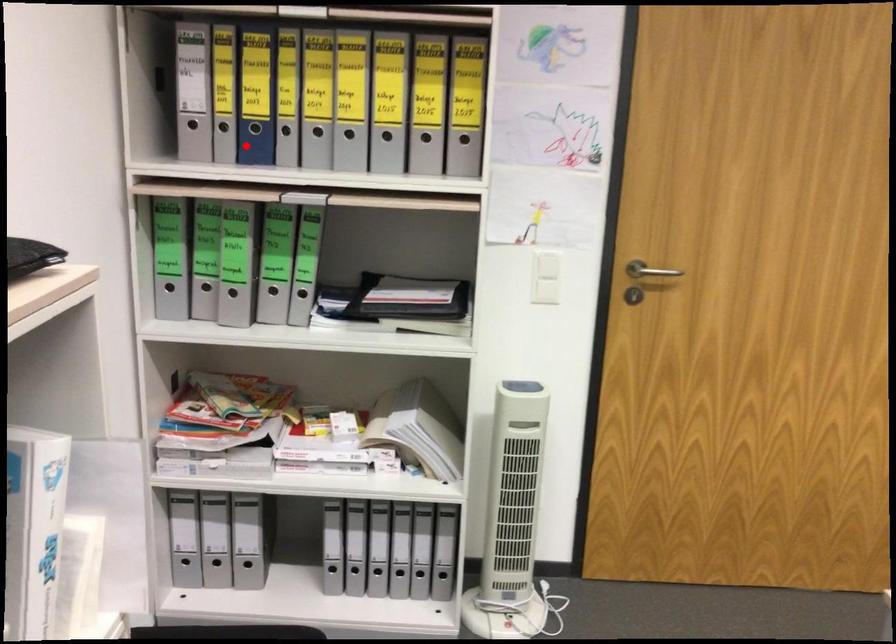
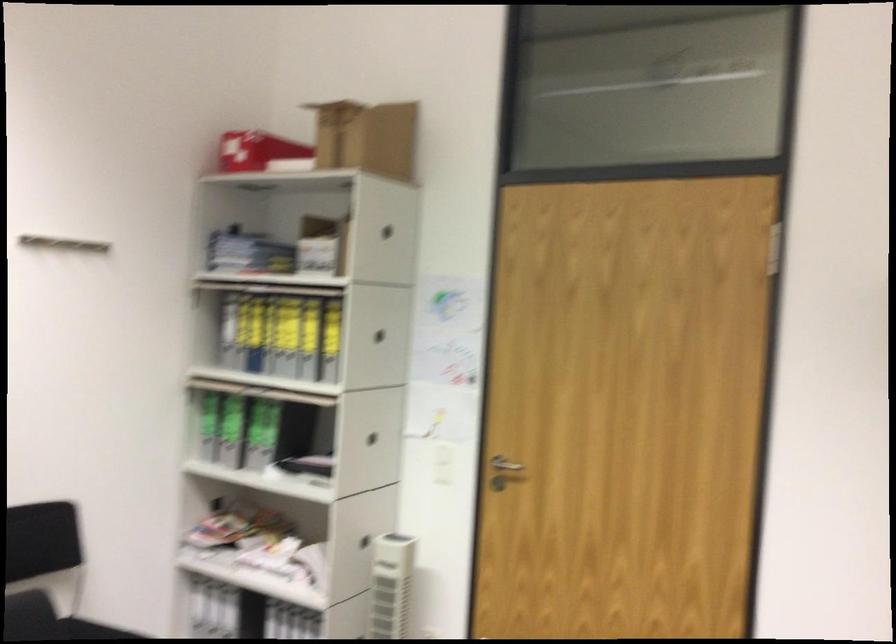
Locate, in the second image, the point that corresponds to the highlighted location in the first image.

(248, 361)